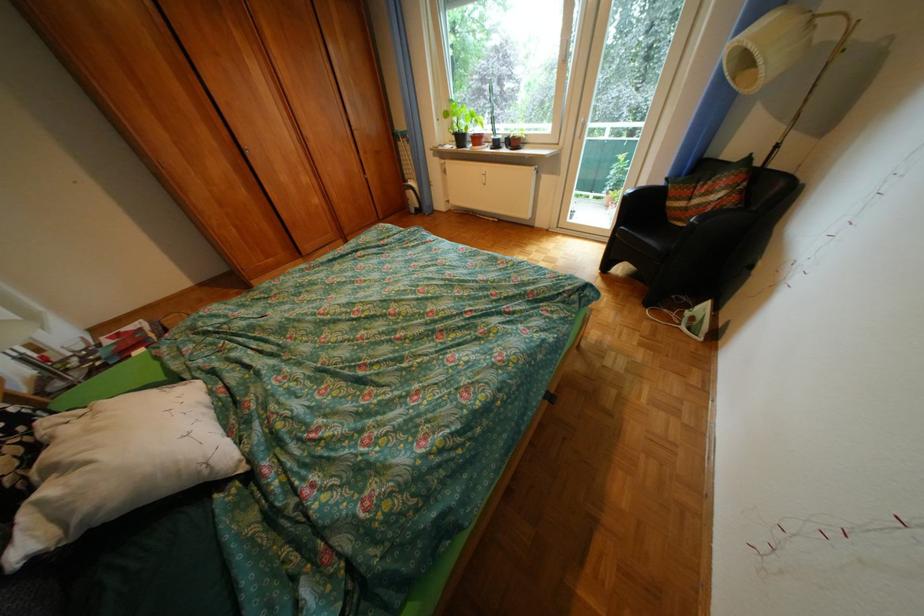
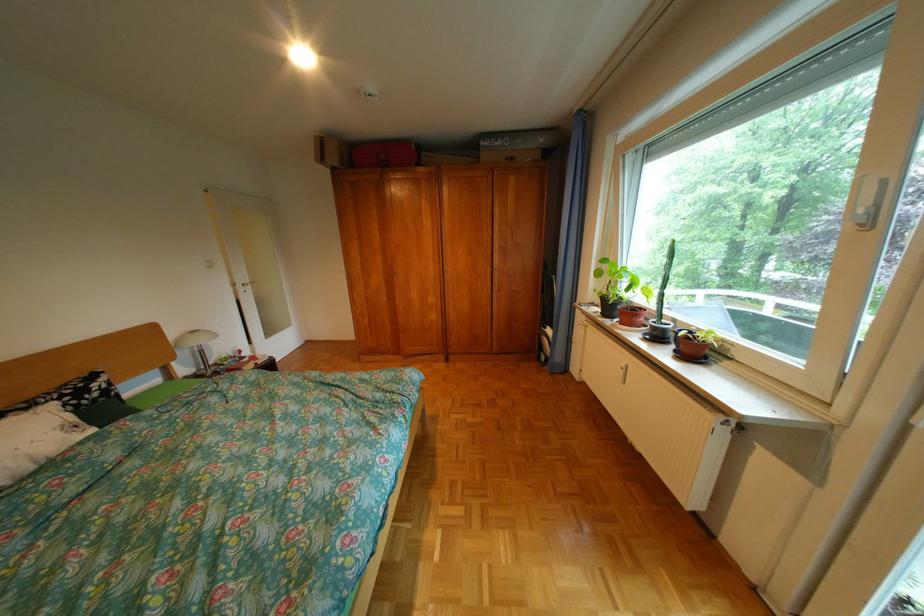
Where in the second image is the point corresponding to (503,151) from the first image?

(650, 338)